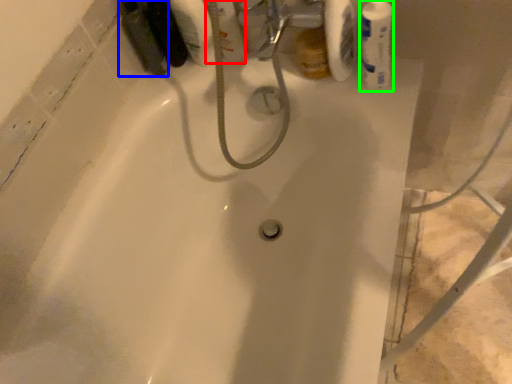
Question: Which is farther away from mouthwash (highlighted by a red box)? mouthwash (highlighted by a blue box) or mouthwash (highlighted by a green box)?

Choices:
 (A) mouthwash
 (B) mouthwash

Answer: (B)